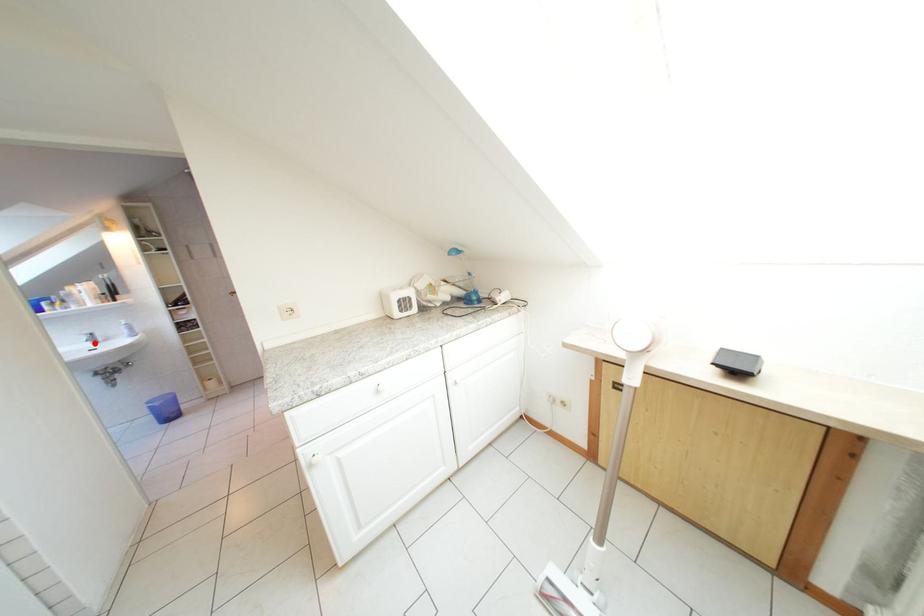
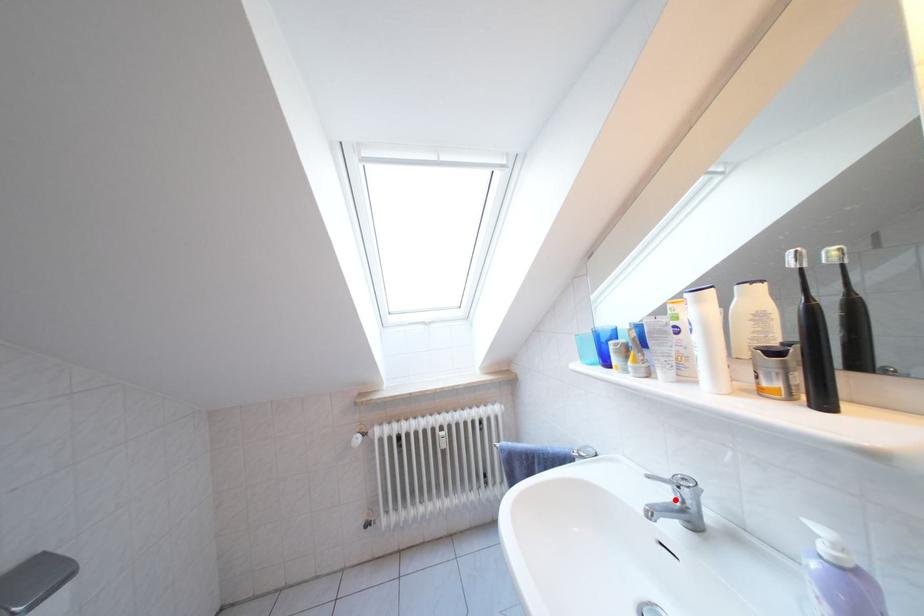
I am providing you with two images of the same scene from different viewpoints. A red point is marked on the first image and another point is marked on the second image. Does the point marked in image1 correspond to the same location as the one in image2?

Yes